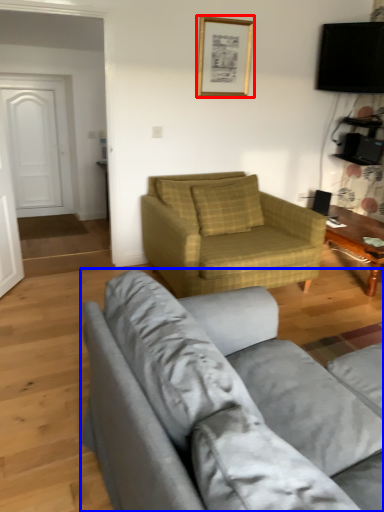
Question: Which of the following is the closest to the observer, picture frame (highlighted by a red box) or studio couch (highlighted by a blue box)?

Choices:
 (A) picture frame
 (B) studio couch

Answer: (B)